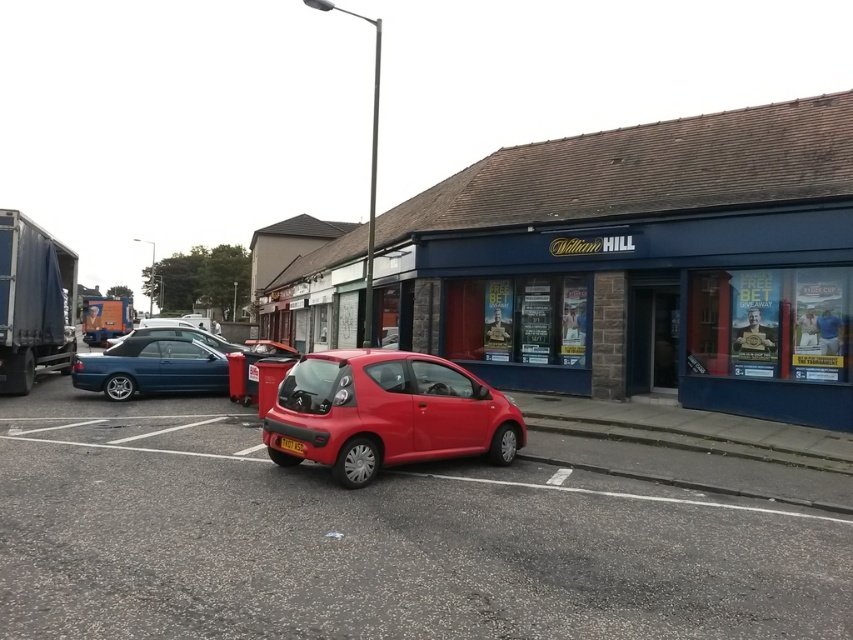
Is metallic blue convertible at center-left positioned at the back of orange cardboard trailer truck at left?

That is False.

Between metallic blue convertible at center-left and orange cardboard trailer truck at left, which one has less height?

Standing shorter between the two is metallic blue convertible at center-left.

Describe the element at coordinates (151, 368) in the screenshot. I see `metallic blue convertible at center-left` at that location.

Identify the location of metallic blue convertible at center-left. (151, 368).

Which is more to the left, metallic red car at center or yellow plastic license plate at center?

metallic red car at center

Who is lower down, metallic red car at center or yellow plastic license plate at center?

Positioned lower is yellow plastic license plate at center.

Is point (619, 592) positioned before point (299, 445)?

Yes, it is.

Locate an element on the screen. metallic red car at center is located at coordinates (375, 540).

Who is lower down, shiny red car at center or blue tarpaulin trailer truck at left?

shiny red car at center is lower down.

Who is more forward, (419, 433) or (15, 310)?

Positioned in front is point (419, 433).

Identify the location of shiny red car at center. This screenshot has height=640, width=853. (387, 412).